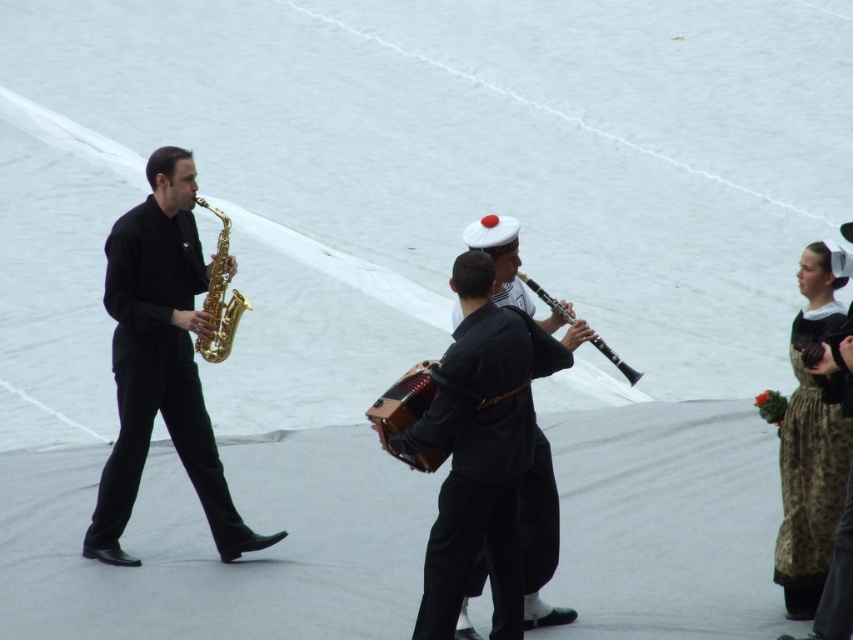
You are a photographer setting up a tripod to capture the performance. You want to ensure that both the black fabric uniform at center and the brown wooden accordion at center are in focus. Given that the camera can only focus on objects of a certain height, which object should you adjust the focus for first based on their height?

The black fabric uniform at center is taller than the brown wooden accordion at center, so you should adjust the focus for the black fabric uniform at center first to ensure both are in focus.

You are organizing a small performance and need to ensure that the brown textured dress at right and the brown wooden accordion at center can fit side by side on a 1.5 meter wide stage. Based on their widths, will they fit together?

The brown textured dress at right is wider than the brown wooden accordion at center. However, without knowing their exact widths, it is impossible to determine if their combined width exceeds 1.5 meters. Additional measurements are needed.

You are a photographer setting up for a photo shoot at the outdoor stage. You need to position a spotlight so it can illuminate both the brown textured dress at right and the gold shiny saxophone at left. Given their heights, which object should you aim the spotlight higher to properly light?

The brown textured dress at right is taller than the gold shiny saxophone at left, so you should aim the spotlight higher to properly light the brown textured dress at right.